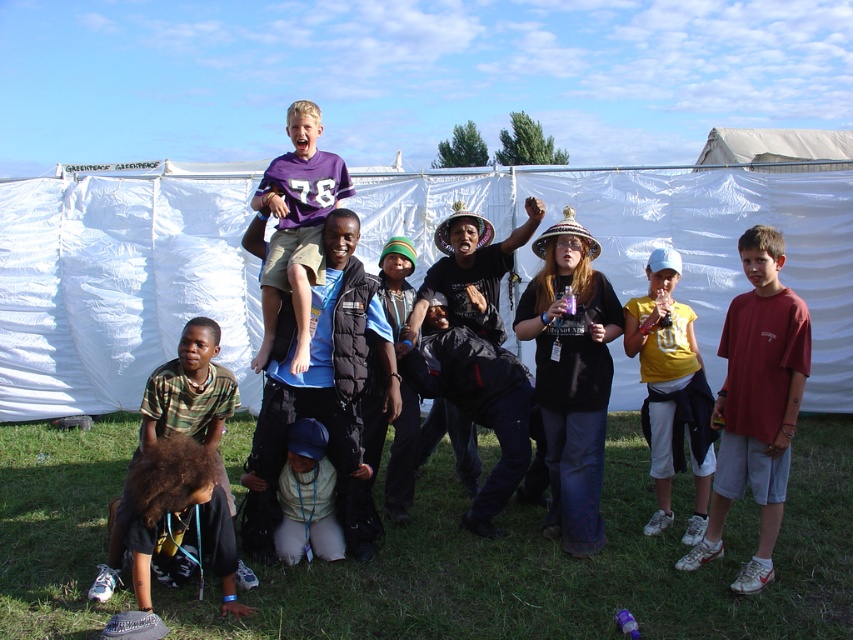
Does point (822, 579) come closer to viewer compared to point (265, 476)?

Yes.

Is green grass at lower center bigger than black puffer vest at center?

No, green grass at lower center is not bigger than black puffer vest at center.

Find the location of a particular element. The width and height of the screenshot is (853, 640). green grass at lower center is located at coordinates (567, 564).

At what (x,y) coordinates should I click in order to perform the action: click on green grass at lower center. Please return your answer as a coordinate pair (x, y). This screenshot has width=853, height=640. Looking at the image, I should click on (567, 564).

Does white fabric tent at upper center have a greater height compared to yellow cotton shirt at center-right?

Yes.

Can you confirm if white fabric tent at upper center is wider than yellow cotton shirt at center-right?

Correct, the width of white fabric tent at upper center exceeds that of yellow cotton shirt at center-right.

Is point (798, 212) closer to camera compared to point (674, 368)?

No.

You are a GUI agent. You are given a task and a screenshot of the screen. Output one action in this format:
    pyautogui.click(x=<x>, y=<y>)
    Task: Click on the white fabric tent at upper center
    The image size is (853, 640).
    Given the screenshot: What is the action you would take?
    point(117,285)

Does point (515, 513) lie behind point (676, 416)?

Yes, point (515, 513) is behind point (676, 416).

Which of these two, green grass at lower center or yellow cotton shirt at center-right, stands shorter?

green grass at lower center is shorter.

Between point (244, 429) and point (693, 513), which one is positioned behind?

Point (244, 429)

Where is `green grass at lower center`? green grass at lower center is located at coordinates (567, 564).